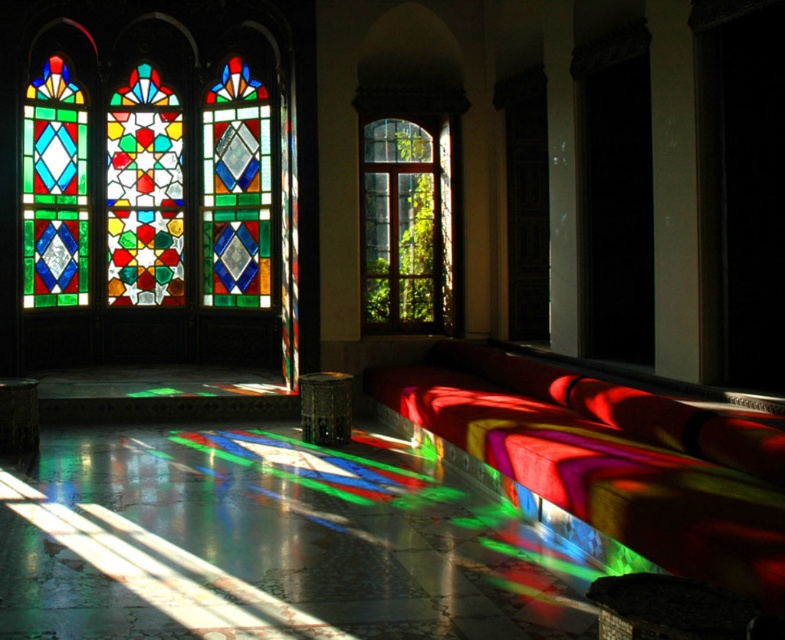
Question: Does velvet red bench at center have a larger size compared to clear glass window at center?

Choices:
 (A) yes
 (B) no

Answer: (A)

Question: Based on their relative distances, which object is nearer to the velvet red bench at center?

Choices:
 (A) stained glass window at upper left
 (B) clear glass window at center

Answer: (B)

Question: From the image, what is the correct spatial relationship of stained glass window at upper left in relation to clear glass window at center?

Choices:
 (A) above
 (B) below

Answer: (A)

Question: Which point is farther to the camera?

Choices:
 (A) (x=59, y=76)
 (B) (x=373, y=256)
 (C) (x=710, y=508)

Answer: (A)

Question: Estimate the real-world distances between objects in this image. Which object is farther from the clear glass window at center?

Choices:
 (A) stained glass window at upper left
 (B) velvet red bench at center

Answer: (A)

Question: Can you confirm if velvet red bench at center is thinner than clear glass window at center?

Choices:
 (A) yes
 (B) no

Answer: (B)